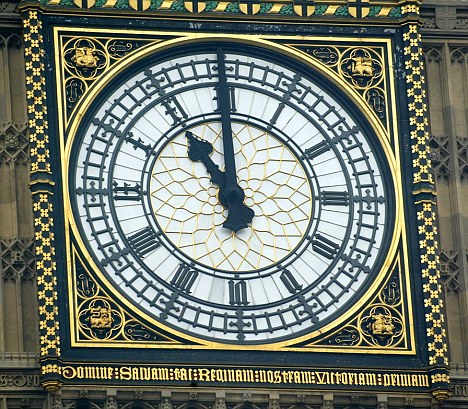
The height and width of the screenshot is (409, 468). Identify the location of clock hand. (x=201, y=150), (x=227, y=161).